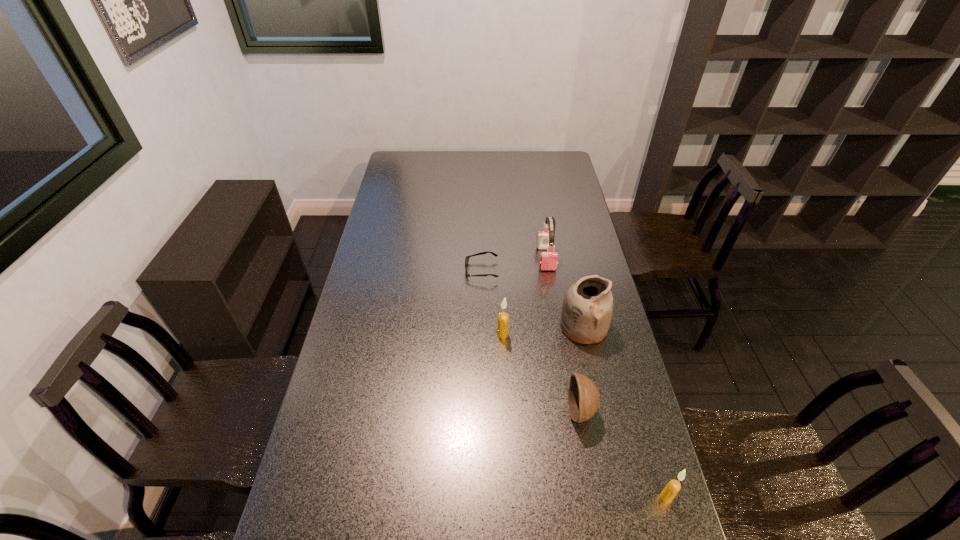
At what (x,y) coordinates should I click in order to perform the action: click on vacant space that's between the earphone and the shorter candle. Please return your answer as a coordinate pair (x, y). The width and height of the screenshot is (960, 540). Looking at the image, I should click on (606, 377).

This screenshot has height=540, width=960. In order to click on free spot between the earphone and the left candle in this screenshot , I will do `click(524, 296)`.

Identify the location of empty location between the sunglasses and the earphone. The height and width of the screenshot is (540, 960). pos(514,265).

Locate an element on the screen. free point between the sunglasses and the left candle is located at coordinates (492, 302).

Identify which object is the third nearest to the shortest object. Please provide its 2D coordinates. Your answer should be formatted as a tuple, i.e. [(x, y)], where the tuple contains the x and y coordinates of a point satisfying the conditions above.

[(587, 308)]

Identify which object is located as the nearest to the nearest object. Please provide its 2D coordinates. Your answer should be formatted as a tuple, i.e. [(x, y)], where the tuple contains the x and y coordinates of a point satisfying the conditions above.

[(583, 396)]

You are a GUI agent. You are given a task and a screenshot of the screen. Output one action in this format:
    pyautogui.click(x=<x>, y=<y>)
    Task: Click on the vacant area that satisfies the following two spatial constraints: 1. on the lenses of the sunglasses; 2. on the right side of the right candle
    The width and height of the screenshot is (960, 540).
    Given the screenshot: What is the action you would take?
    click(482, 497)

In order to click on free location that satisfies the following two spatial constraints: 1. on the outer surface of the earphone; 2. on the lenses of the sunglasses in this screenshot , I will do `click(548, 271)`.

At what (x,y) coordinates should I click in order to perform the action: click on vacant space that satisfies the following two spatial constraints: 1. on the front side of the taller candle; 2. on the right side of the second nearest object. Please return your answer as a coordinate pair (x, y). The height and width of the screenshot is (540, 960). Looking at the image, I should click on (506, 411).

The height and width of the screenshot is (540, 960). Identify the location of vacant space that satisfies the following two spatial constraints: 1. on the lenses of the shortest object; 2. on the right side of the pottery. (482, 327).